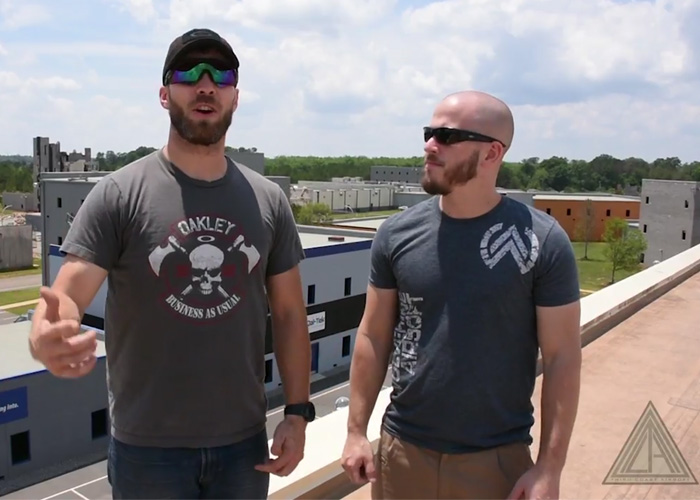
At what (x,y) coordinates should I click in order to perform the action: click on shades. Please return your answer as a coordinate pair (x, y). Looking at the image, I should click on (452, 136), (218, 71).